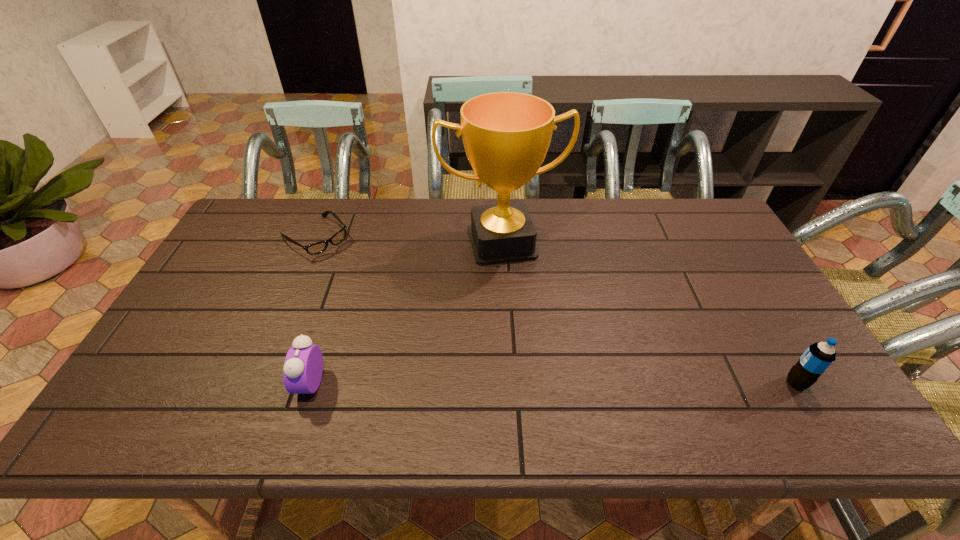
Where is `vacant area between the award and the spectacles`? The width and height of the screenshot is (960, 540). vacant area between the award and the spectacles is located at coordinates (409, 240).

Locate an element on the screen. This screenshot has width=960, height=540. vacant area that lies between the award and the shortest object is located at coordinates (409, 240).

Identify the location of vacant region between the tallest object and the alarm clock. (406, 313).

This screenshot has height=540, width=960. I want to click on free space between the award and the alarm clock, so click(x=406, y=313).

The image size is (960, 540). Identify the location of free spot between the third tallest object and the third object from left to right. (406, 313).

At what (x,y) coordinates should I click in order to perform the action: click on vacant point located between the third object from left to right and the shortest object. Please return your answer as a coordinate pair (x, y). Looking at the image, I should click on (409, 240).

Locate an element on the screen. free point between the third tallest object and the second tallest object is located at coordinates (553, 383).

Locate an element on the screen. The image size is (960, 540). object that is the third nearest to the rightmost object is located at coordinates (319, 247).

Identify which object is located as the second nearest to the rightmost object. Please provide its 2D coordinates. Your answer should be formatted as a tuple, i.e. [(x, y)], where the tuple contains the x and y coordinates of a point satisfying the conditions above.

[(303, 367)]

Where is `vacant space that satisfies the following two spatial constraints: 1. on the front side of the third shortest object; 2. on the left side of the third object from left to right`? The height and width of the screenshot is (540, 960). vacant space that satisfies the following two spatial constraints: 1. on the front side of the third shortest object; 2. on the left side of the third object from left to right is located at coordinates (510, 383).